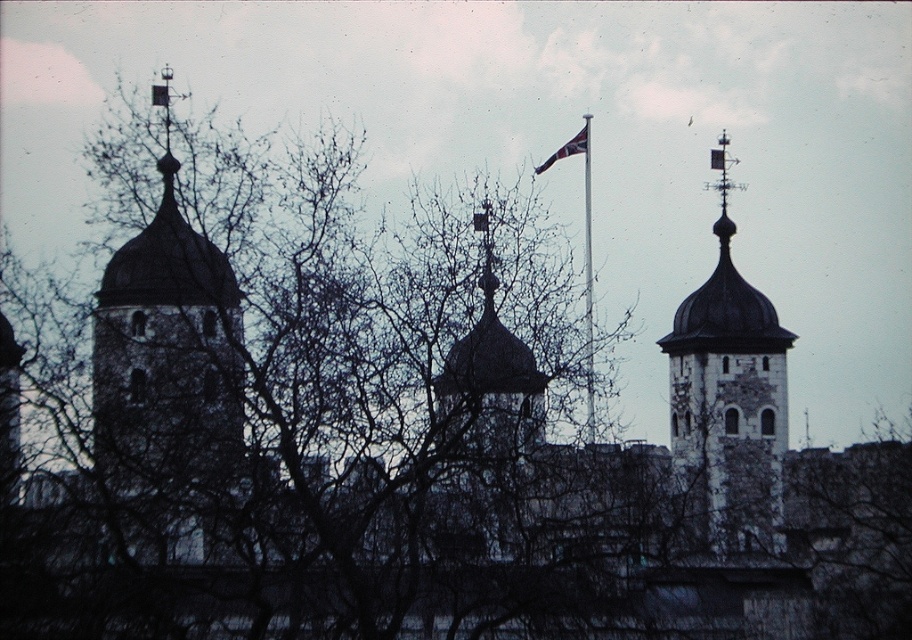
Question: Which object appears closest to the camera in this image?

Choices:
 (A) red flag at center
 (B) polished metal flag pole at center
 (C) stone dome at upper center

Answer: (B)

Question: Does polished metal flag pole at center appear on the left side of red flag at center?

Choices:
 (A) yes
 (B) no

Answer: (B)

Question: Which point is closer to the camera?

Choices:
 (A) red flag at center
 (B) stone dome at upper center
 (C) polished metal flag pole at center

Answer: (C)

Question: Does polished metal flag pole at center have a smaller size compared to red flag at center?

Choices:
 (A) yes
 (B) no

Answer: (B)

Question: Which of these objects is positioned closest to the red flag at center?

Choices:
 (A) polished metal flag pole at center
 (B) stone dome at upper center

Answer: (A)

Question: Does stone dome at upper center appear under red flag at center?

Choices:
 (A) no
 (B) yes

Answer: (B)